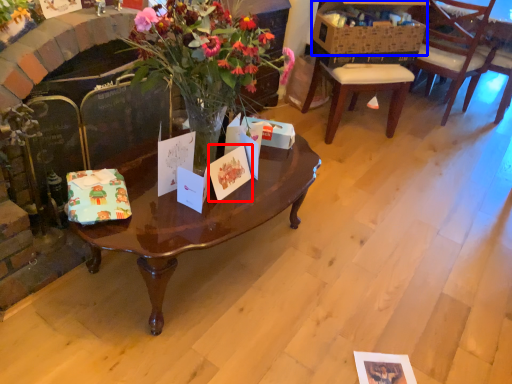
Question: Which object is closer to the camera taking this photo, gift card (highlighted by a red box) or box (highlighted by a blue box)?

Choices:
 (A) gift card
 (B) box

Answer: (A)